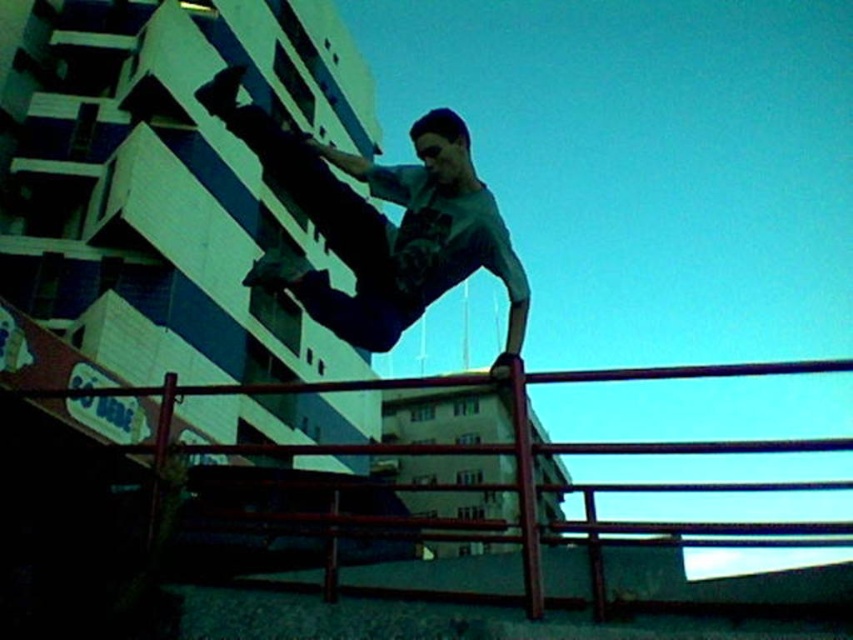
Question: Is the position of matte gray shirt at center less distant than that of smooth metal rail at center?

Choices:
 (A) yes
 (B) no

Answer: (B)

Question: Which of the following is the farthest from the observer?

Choices:
 (A) (573, 445)
 (B) (521, 320)

Answer: (B)

Question: Which object appears farthest from the camera in this image?

Choices:
 (A) smooth metal rail at center
 (B) matte gray shirt at center

Answer: (B)

Question: Does matte gray shirt at center appear over smooth metal rail at center?

Choices:
 (A) yes
 (B) no

Answer: (A)

Question: Is matte gray shirt at center closer to camera compared to smooth metal rail at center?

Choices:
 (A) yes
 (B) no

Answer: (B)

Question: Among these objects, which one is farthest from the camera?

Choices:
 (A) matte gray shirt at center
 (B) smooth metal rail at center

Answer: (A)